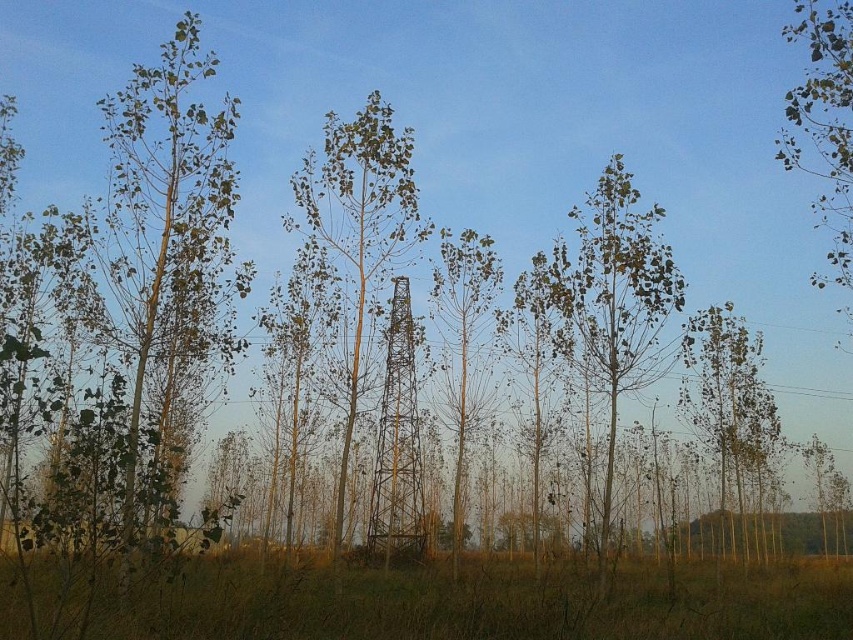
Between point (207, 572) and point (456, 465), which one is positioned in front?

Point (207, 572)

Is brown grass at lower center taller than green leafy tree at center?

No, brown grass at lower center is not taller than green leafy tree at center.

Between point (772, 628) and point (482, 368), which one is positioned behind?

The point (482, 368) is behind.

The width and height of the screenshot is (853, 640). I want to click on brown grass at lower center, so click(483, 602).

Who is more distant from viewer, (219, 634) or (582, 276)?

Point (582, 276)

Looking at this image, does brown grass at lower center have a lesser width compared to green matte tree at center?

In fact, brown grass at lower center might be wider than green matte tree at center.

Locate an element on the screen. This screenshot has height=640, width=853. brown grass at lower center is located at coordinates (483, 602).

Image resolution: width=853 pixels, height=640 pixels. Find the location of `brown grass at lower center`. brown grass at lower center is located at coordinates (483, 602).

Between green leafy birch tree at center and green matte tree at upper right, which one has less height?

green matte tree at upper right

Which is behind, point (317, 189) or point (845, 211)?

Point (317, 189)

Is point (334, 244) closer to camera compared to point (840, 250)?

No, it is behind (840, 250).

The image size is (853, 640). Identify the location of green leafy birch tree at center. (360, 225).